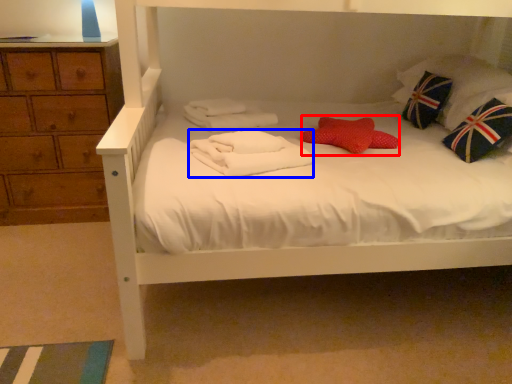
Question: Which point is closer to the camera, pillow (highlighted by a red box) or bath towel (highlighted by a blue box)?

Choices:
 (A) pillow
 (B) bath towel

Answer: (B)